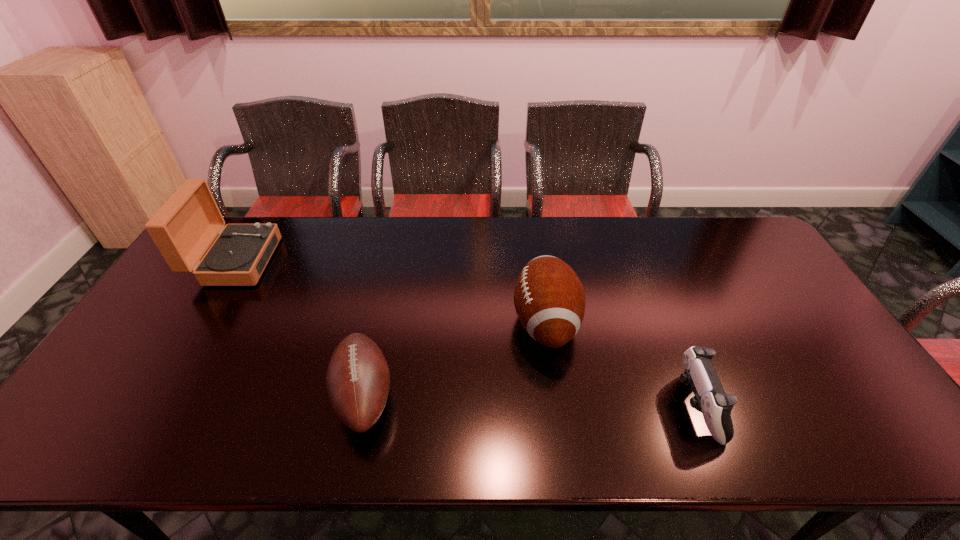
This screenshot has height=540, width=960. In order to click on free area in between the phonograph record and the shorter football (American) in this screenshot , I will do 300,329.

At what (x,y) coordinates should I click in order to perform the action: click on vacant area that lies between the shorter football (American) and the tallest object. Please return your answer as a coordinate pair (x, y). Looking at the image, I should click on (300, 329).

In order to click on vacant area that lies between the leftmost object and the second object from left to right in this screenshot , I will do `click(300, 329)`.

Where is `object that ranks as the closest to the left football (American)`? object that ranks as the closest to the left football (American) is located at coordinates (549, 298).

Identify which object is the nearest to the phonograph record. Please provide its 2D coordinates. Your answer should be formatted as a tuple, i.e. [(x, y)], where the tuple contains the x and y coordinates of a point satisfying the conditions above.

[(358, 379)]

Where is `free space that satisfies the following two spatial constraints: 1. on the laces of the taller football (American); 2. on the front side of the left football (American)`? The height and width of the screenshot is (540, 960). free space that satisfies the following two spatial constraints: 1. on the laces of the taller football (American); 2. on the front side of the left football (American) is located at coordinates (556, 396).